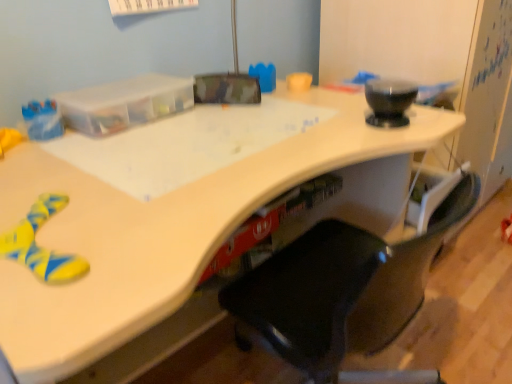
This screenshot has height=384, width=512. Identify the location of free spot above black plastic chair at center (from a real-world perspective). 324,154.